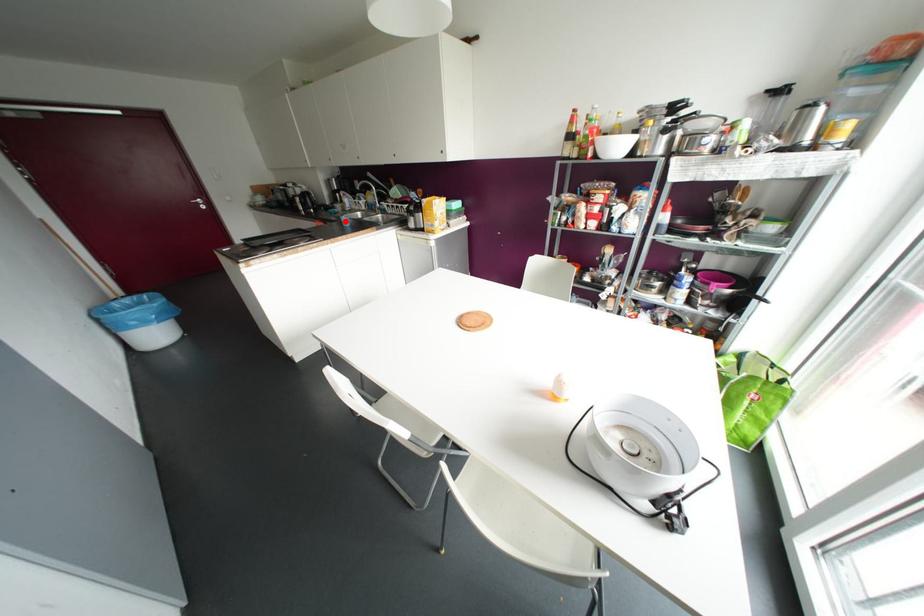
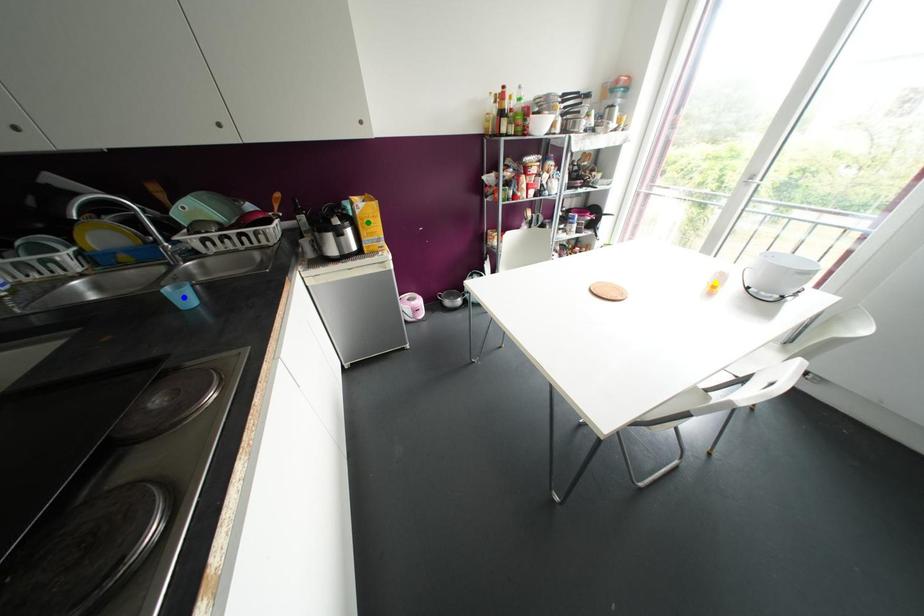
Question: I am providing you with two images of the same scene from different viewpoints. A red point is marked on the first image. You are given multiple points on the second image. Which spot in image 2 lines up with the point in image 1?

Choices:
 (A) green point
 (B) blue point
 (C) yellow point

Answer: (B)